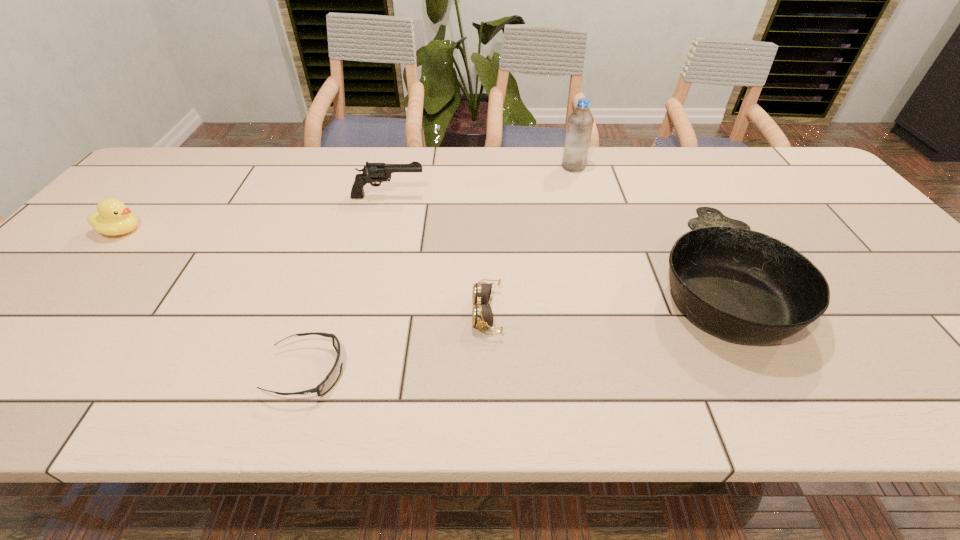
At what (x,y) coordinates should I click in order to perform the action: click on vacant point that satisfies the following two spatial constraints: 1. on the beak of the duckling; 2. with the handle extending from the side of the frying pan. Please return your answer as a coordinate pair (x, y). The height and width of the screenshot is (540, 960). Looking at the image, I should click on (73, 285).

At what (x,y) coordinates should I click in order to perform the action: click on free location that satisfies the following two spatial constraints: 1. at the end of the barrel of the gun; 2. with the handle extending from the side of the frying pan. Please return your answer as a coordinate pair (x, y). The width and height of the screenshot is (960, 540). Looking at the image, I should click on (366, 285).